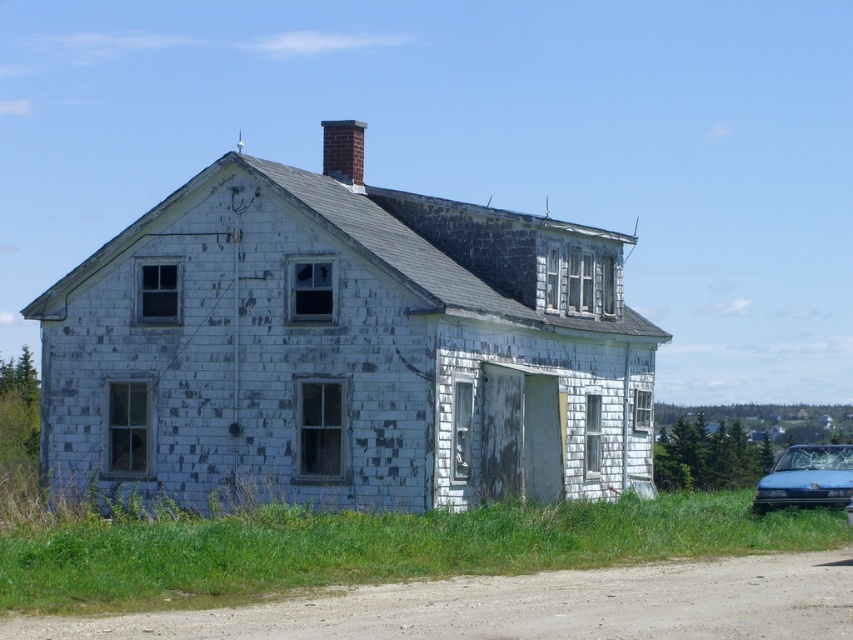
You are a delivery driver who needs to park your blue matte car at lower right near the dusty gravel road at lower center. Can you park the car entirely on the road without any part hanging off?

The dusty gravel road at lower center is shorter than the blue matte car at lower right, so the car cannot be parked entirely on the road without part of it hanging off.

You are a delivery driver approaching the house and need to park your blue matte car at lower right. The dusty gravel road at lower center is the only available parking spot. Can you fit your car there?

The dusty gravel road at lower center occupies less space than the blue matte car at lower right, so the car cannot fit in the parking spot.